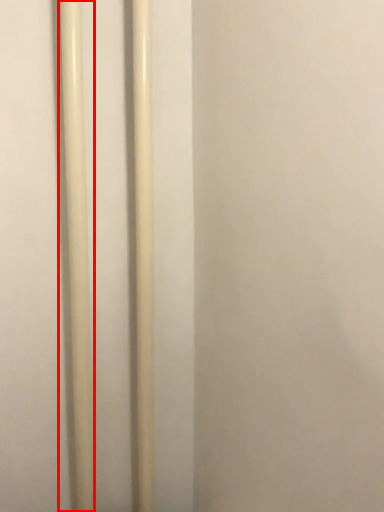
Question: In this image, where is pole (annotated by the red box) located relative to pole?

Choices:
 (A) right
 (B) left

Answer: (B)